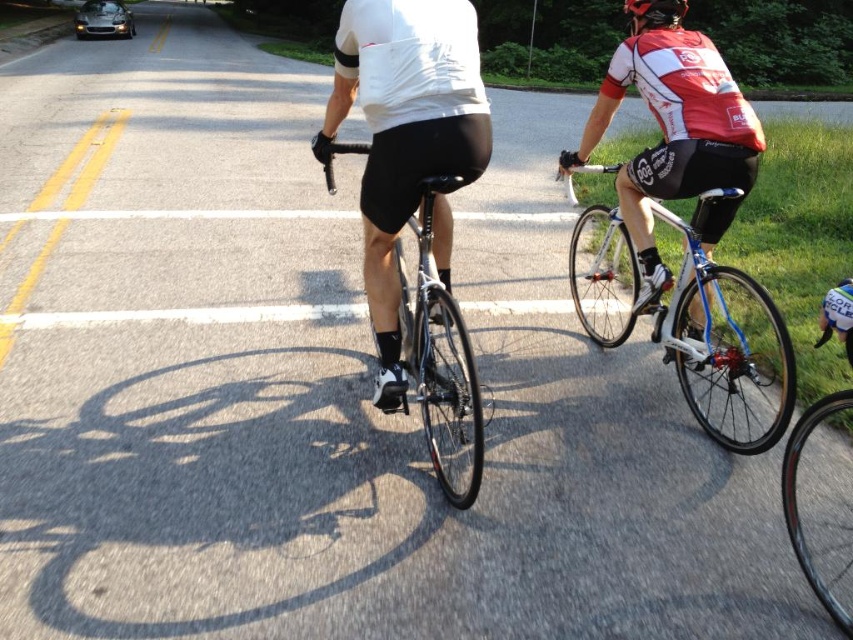
Question: Does white glossy bicycle at center-right appear under black matte helmet at upper center?

Choices:
 (A) no
 (B) yes

Answer: (B)

Question: Which object appears closest to the camera in this image?

Choices:
 (A) white glossy bicycle at center-right
 (B) shiny black bicycle at center
 (C) black matte helmet at upper center

Answer: (B)

Question: Does shiny black bicycle at center have a larger size compared to black matte helmet at upper center?

Choices:
 (A) yes
 (B) no

Answer: (A)

Question: Which point is closer to the camera taking this photo?

Choices:
 (A) (421, 385)
 (B) (670, 339)
 (C) (682, 17)

Answer: (A)

Question: Which object is closer to the camera taking this photo?

Choices:
 (A) black matte helmet at upper center
 (B) shiny black bicycle at center

Answer: (B)

Question: Can you confirm if shiny black bicycle at center is positioned below black matte helmet at upper center?

Choices:
 (A) no
 (B) yes

Answer: (B)